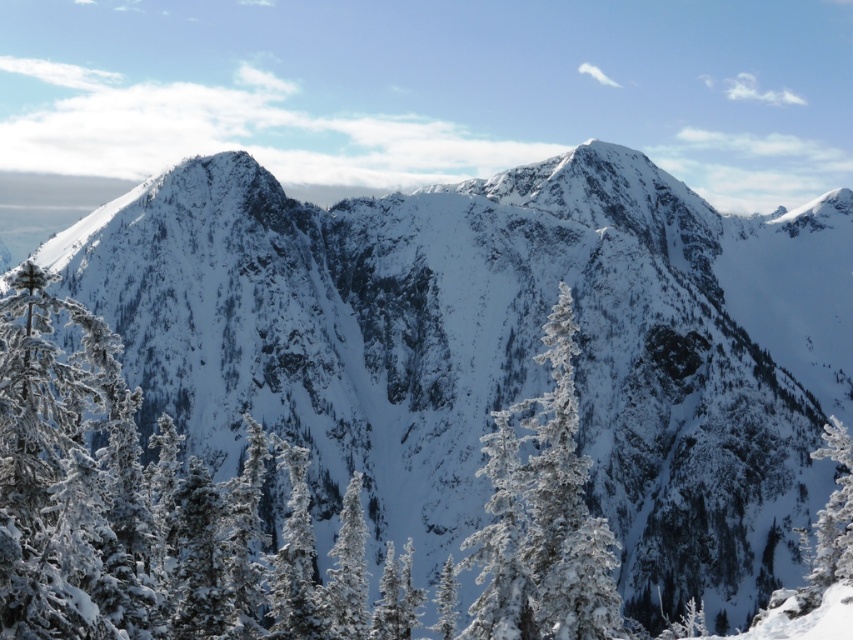
Is white frosty tree at center smaller than white frosty tree at lower right?

No.

Between point (590, 595) and point (814, 584), which one is positioned behind?

The point (814, 584) is behind.

From the picture: Who is more distant from viewer, (502, 595) or (828, 552)?

Positioned behind is point (828, 552).

The width and height of the screenshot is (853, 640). In order to click on white frosty tree at center in this screenshot , I will do `click(543, 518)`.